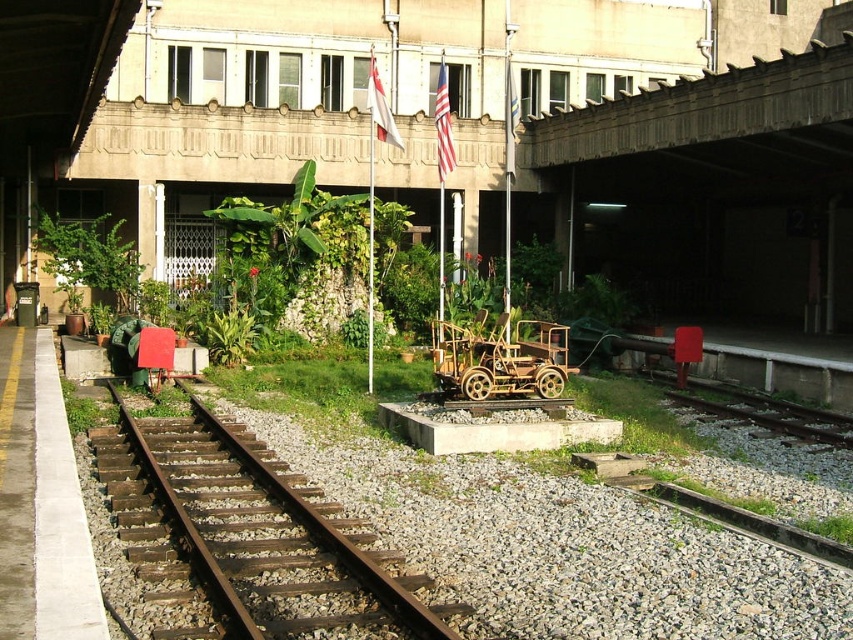
Question: Estimate the real-world distances between objects in this image. Which object is closer to the rusty metal train track at center?

Choices:
 (A) concrete textured overpass at upper center
 (B) wooden cart at center

Answer: (B)

Question: Which is nearer to the wooden cart at center?

Choices:
 (A) rusty metal train track at center
 (B) concrete textured overpass at upper center

Answer: (A)

Question: Is rusty metal train track at center smaller than concrete textured overpass at upper center?

Choices:
 (A) no
 (B) yes

Answer: (B)

Question: Among these objects, which one is nearest to the camera?

Choices:
 (A) rusty metal train track at center
 (B) wooden cart at center
 (C) concrete textured overpass at upper center

Answer: (A)

Question: Can you confirm if rusty metal train track at center is wider than concrete textured overpass at upper center?

Choices:
 (A) yes
 (B) no

Answer: (B)

Question: Is concrete textured overpass at upper center below wooden cart at center?

Choices:
 (A) yes
 (B) no

Answer: (B)